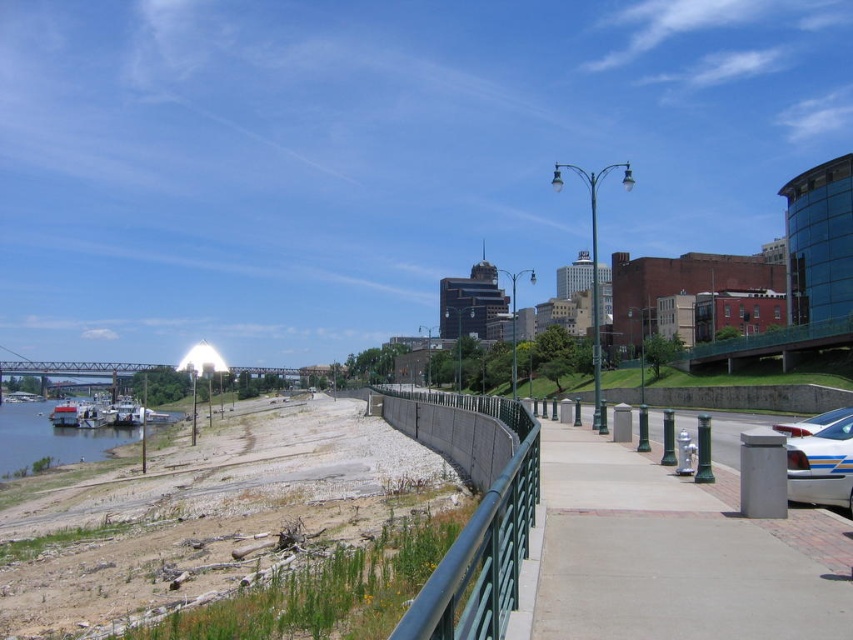
You are standing at the riverside and want to reach the gray concrete pavement at center. According to the coordinates provided, in which direction should you move from your current position at the riverside?

You should move towards the center of the image to reach the gray concrete pavement at center, as it is located at coordinates point (x=674, y=554).

You are a pedestrian standing on the gray concrete pavement at center and want to cross the metallic steel bridge at left. Can you reach the bridge from your current position without leaving the pavement?

The gray concrete pavement at center is shorter than the metallic steel bridge at left, so you can reach the bridge from your current position since the pavement extends towards it.